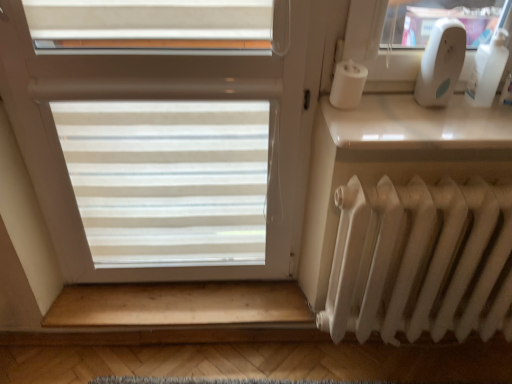
This screenshot has width=512, height=384. Find the location of `white matte radiator at lower right`. white matte radiator at lower right is located at coordinates (421, 261).

In order to click on wooden at lower in this screenshot , I will do `click(179, 304)`.

Does white translucent blinds at center have a smaller size compared to wooden at lower?

Actually, white translucent blinds at center might be larger than wooden at lower.

Which object is wider, white translucent blinds at center or wooden at lower?

wooden at lower.

Is white translucent blinds at center touching wooden at lower?

white translucent blinds at center and wooden at lower are clearly separated.

Locate an element on the screen. window that appears above the wooden at lower (from the image's perspective) is located at coordinates (167, 130).

Is white translucent blinds at center smaller than white plastic bottle at upper right?

No.

From the image's perspective, is white translucent blinds at center located above white plastic bottle at upper right?

No.

Relative to white plastic bottle at upper right, is white translucent blinds at center in front or behind?

Visually, white translucent blinds at center is located in front of white plastic bottle at upper right.

Which is in front, point (7, 32) or point (479, 92)?

Point (7, 32)

Does white glossy window sill at upper right have a greater height compared to white translucent blinds at center?

Incorrect, the height of white glossy window sill at upper right is not larger of that of white translucent blinds at center.

From a real-world perspective, who is located higher, white glossy window sill at upper right or white translucent blinds at center?

white glossy window sill at upper right.

Can you tell me how much white glossy window sill at upper right and white translucent blinds at center differ in facing direction?

The angle between the facing direction of white glossy window sill at upper right and the facing direction of white translucent blinds at center is 0.0127 degrees.

Is white glossy window sill at upper right not within white translucent blinds at center?

white glossy window sill at upper right is positioned outside white translucent blinds at center.

Can you confirm if white translucent blinds at center is thinner than white matte radiator at lower right?

Yes.

Between white translucent blinds at center and white matte radiator at lower right, which one has more height?

white translucent blinds at center.

From the image's perspective, is white translucent blinds at center located beneath white matte radiator at lower right?

No.

Based on the photo, considering the sizes of white translucent blinds at center and white matte radiator at lower right in the image, is white translucent blinds at center bigger or smaller than white matte radiator at lower right?

Clearly, white translucent blinds at center is larger in size than white matte radiator at lower right.

Based on the photo, is wooden at lower to the left or to the right of white glossy window sill at upper right in the image?

Clearly, wooden at lower is on the left of white glossy window sill at upper right in the image.

Considering the positions of objects wooden at lower and white glossy window sill at upper right in the image provided, who is behind, wooden at lower or white glossy window sill at upper right?

wooden at lower is further from the camera.

From the picture: Can you tell me how much wooden at lower and white glossy window sill at upper right differ in facing direction?

wooden at lower and white glossy window sill at upper right are facing 1.87e-05 degrees away from each other.

Is wooden at lower thinner than white glossy window sill at upper right?

Indeed, wooden at lower has a lesser width compared to white glossy window sill at upper right.

Which of these two, white matte radiator at lower right or white plastic bottle at upper right, is wider?

white matte radiator at lower right is wider.

In the scene shown: Is white matte radiator at lower right inside or outside of white plastic bottle at upper right?

white matte radiator at lower right is not inside white plastic bottle at upper right, it's outside.

Between point (424, 228) and point (498, 79), which one is positioned behind?

The point (424, 228) is farther.

The image size is (512, 384). I want to click on radiator lying on the left of white plastic bottle at upper right, so click(x=421, y=261).

Is white matte radiator at lower right shorter than white glossy window sill at upper right?

Incorrect, the height of white matte radiator at lower right does not fall short of that of white glossy window sill at upper right.

Would you consider white matte radiator at lower right to be distant from white glossy window sill at upper right?

Actually, white matte radiator at lower right and white glossy window sill at upper right are a little close together.

In the image, is white matte radiator at lower right positioned in front of or behind white glossy window sill at upper right?

Visually, white matte radiator at lower right is located behind white glossy window sill at upper right.

From a real-world perspective, is white matte radiator at lower right on white glossy window sill at upper right?

Actually, white matte radiator at lower right is physically below white glossy window sill at upper right in the real world.

The image size is (512, 384). I want to click on stairwell located behind the white translucent blinds at center, so click(x=179, y=304).

Locate an element on the screen. Image resolution: width=512 pixels, height=384 pixels. window that appears on the left of white plastic bottle at upper right is located at coordinates (167, 130).

Considering their positions, is white translucent blinds at center positioned closer to white glossy window sill at upper right than white matte radiator at lower right?

The object closer to white glossy window sill at upper right is white matte radiator at lower right.

Based on their spatial positions, is white matte radiator at lower right or white plastic bottle at upper right further from wooden at lower?

The object further to wooden at lower is white plastic bottle at upper right.

Which object lies nearer to the anchor point white translucent blinds at center, white matte radiator at lower right or wooden at lower?

Among the two, wooden at lower is located nearer to white translucent blinds at center.

Which object lies further to the anchor point white translucent blinds at center, white matte radiator at lower right or white glossy window sill at upper right?

white matte radiator at lower right.

Estimate the real-world distances between objects in this image. Which object is further from wooden at lower, white glossy window sill at upper right or white translucent blinds at center?

white glossy window sill at upper right is positioned further to the anchor wooden at lower.

When comparing their distances from white matte radiator at lower right, does white glossy window sill at upper right or wooden at lower seem further?

wooden at lower is positioned further to the anchor white matte radiator at lower right.

Estimate the real-world distances between objects in this image. Which object is further from white plastic bottle at upper right, white glossy window sill at upper right or wooden at lower?

wooden at lower.

From the image, which object appears to be farther from white plastic bottle at upper right, white translucent blinds at center or white glossy window sill at upper right?

white translucent blinds at center is further to white plastic bottle at upper right.

In order to click on window sill between wooden at lower and white matte radiator at lower right in the horizontal direction in this screenshot , I will do `click(417, 124)`.

Locate an element on the screen. The width and height of the screenshot is (512, 384). radiator between white translucent blinds at center and white plastic bottle at upper right in the horizontal direction is located at coordinates (421, 261).

At what (x,y) coordinates should I click in order to perform the action: click on radiator situated between wooden at lower and white plastic bottle at upper right from left to right. Please return your answer as a coordinate pair (x, y). This screenshot has height=384, width=512. Looking at the image, I should click on (421, 261).

Image resolution: width=512 pixels, height=384 pixels. In order to click on window between wooden at lower and white matte radiator at lower right in the horizontal direction in this screenshot , I will do `click(167, 130)`.